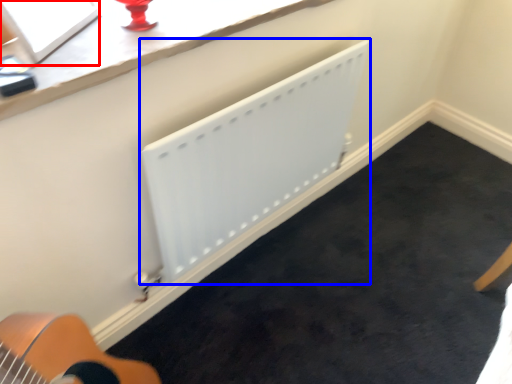
Question: Which of the following is the farthest to the observer, window screen (highlighted by a red box) or radiator (highlighted by a blue box)?

Choices:
 (A) window screen
 (B) radiator

Answer: (B)